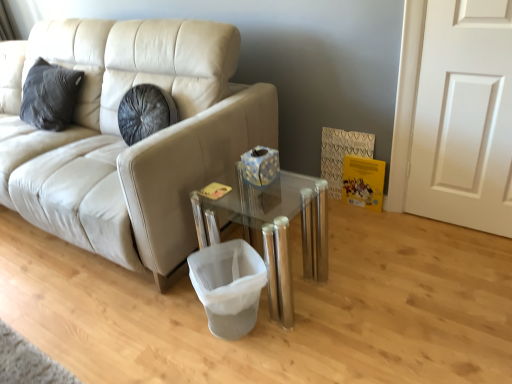
Question: Is beige leather couch at left facing towards white fabric laundry basket at lower center?

Choices:
 (A) yes
 (B) no

Answer: (B)

Question: Does beige leather couch at left have a greater width compared to white fabric laundry basket at lower center?

Choices:
 (A) no
 (B) yes

Answer: (B)

Question: Considering the relative positions of beige leather couch at left and white fabric laundry basket at lower center in the image provided, is beige leather couch at left behind white fabric laundry basket at lower center?

Choices:
 (A) yes
 (B) no

Answer: (B)

Question: Would you consider beige leather couch at left to be distant from white fabric laundry basket at lower center?

Choices:
 (A) yes
 (B) no

Answer: (B)

Question: Is beige leather couch at left at the left side of white fabric laundry basket at lower center?

Choices:
 (A) no
 (B) yes

Answer: (B)

Question: In the image, is beige leather couch at left positioned in front of or behind white fabric laundry basket at lower center?

Choices:
 (A) front
 (B) behind

Answer: (A)

Question: Is beige leather couch at left inside the boundaries of white fabric laundry basket at lower center, or outside?

Choices:
 (A) outside
 (B) inside

Answer: (A)

Question: From the image's perspective, is beige leather couch at left located above or below white fabric laundry basket at lower center?

Choices:
 (A) below
 (B) above

Answer: (B)

Question: From a real-world perspective, is beige leather couch at left physically located above or below white fabric laundry basket at lower center?

Choices:
 (A) above
 (B) below

Answer: (A)

Question: Looking at their shapes, would you say transparent glass table at center is wider or thinner than beige leather couch at left?

Choices:
 (A) wide
 (B) thin

Answer: (B)

Question: Considering the positions of transparent glass table at center and beige leather couch at left in the image, is transparent glass table at center bigger or smaller than beige leather couch at left?

Choices:
 (A) big
 (B) small

Answer: (B)

Question: Based on their positions, is transparent glass table at center located to the left or right of beige leather couch at left?

Choices:
 (A) left
 (B) right

Answer: (B)

Question: From a real-world perspective, is transparent glass table at center positioned above or below beige leather couch at left?

Choices:
 (A) below
 (B) above

Answer: (A)

Question: Is beige leather couch at left inside the boundaries of white matte door at right, or outside?

Choices:
 (A) outside
 (B) inside

Answer: (A)

Question: From the image's perspective, relative to white matte door at right, is beige leather couch at left above or below?

Choices:
 (A) below
 (B) above

Answer: (B)